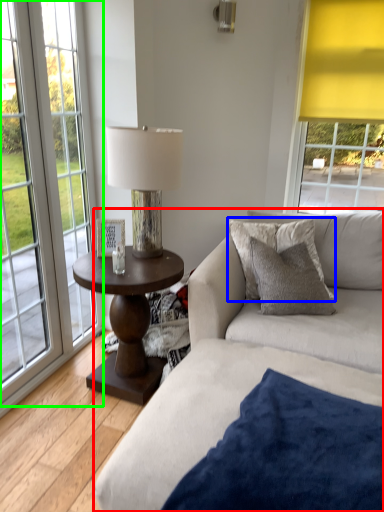
Question: Considering the real-world distances, which object is farthest from studio couch (highlighted by a red box)? pillow (highlighted by a blue box) or window (highlighted by a green box)?

Choices:
 (A) pillow
 (B) window

Answer: (B)